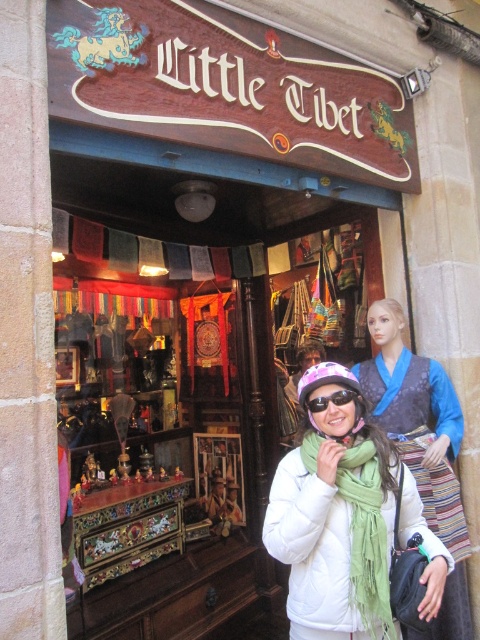
Which is above, green fringed scarf at center or matte purple goggles at center?

matte purple goggles at center is higher up.

Does green fringed scarf at center appear under matte purple goggles at center?

Yes.

The height and width of the screenshot is (640, 480). Describe the element at coordinates (367, 538) in the screenshot. I see `green fringed scarf at center` at that location.

The height and width of the screenshot is (640, 480). In order to click on green fringed scarf at center in this screenshot , I will do (367, 538).

Which is above, white matte jacket at center or green fringed scarf at center?

white matte jacket at center is above.

Between white matte jacket at center and green fringed scarf at center, which one has more height?

white matte jacket at center is taller.

Where is `white matte jacket at center`? white matte jacket at center is located at coordinates (345, 520).

Does white matte jacket at center appear under matte purple goggles at center?

Correct, white matte jacket at center is located below matte purple goggles at center.

Does white matte jacket at center have a larger size compared to matte purple goggles at center?

Yes, white matte jacket at center is bigger than matte purple goggles at center.

Is point (304, 611) more distant than point (332, 392)?

No, it is in front of (332, 392).

Where is `white matte jacket at center`? white matte jacket at center is located at coordinates pos(345,520).